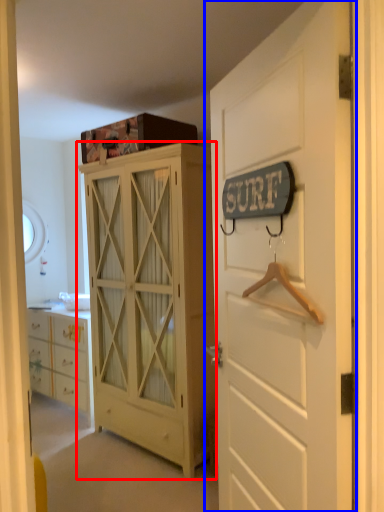
Question: Among these objects, which one is nearest to the camera, cabinetry (highlighted by a red box) or door (highlighted by a blue box)?

Choices:
 (A) cabinetry
 (B) door

Answer: (B)